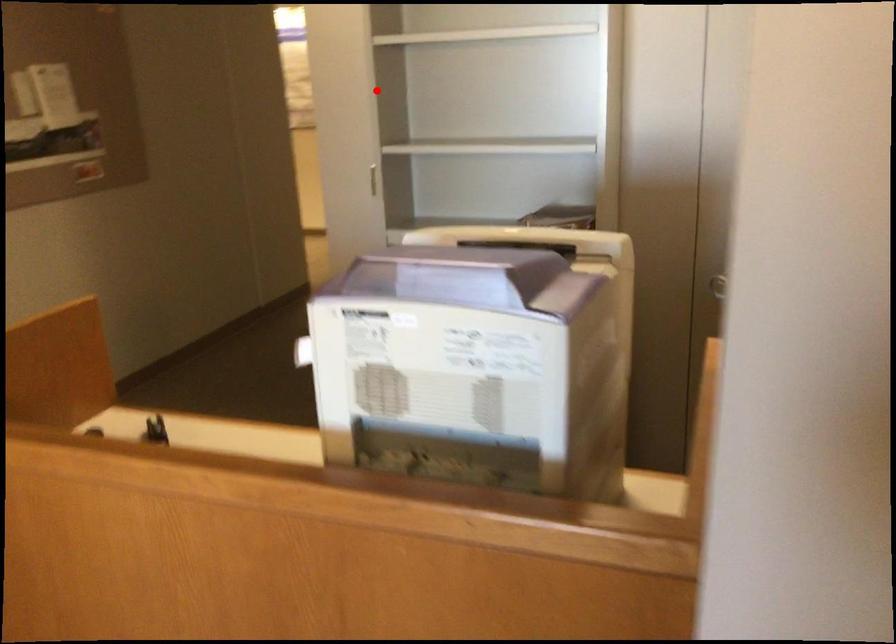
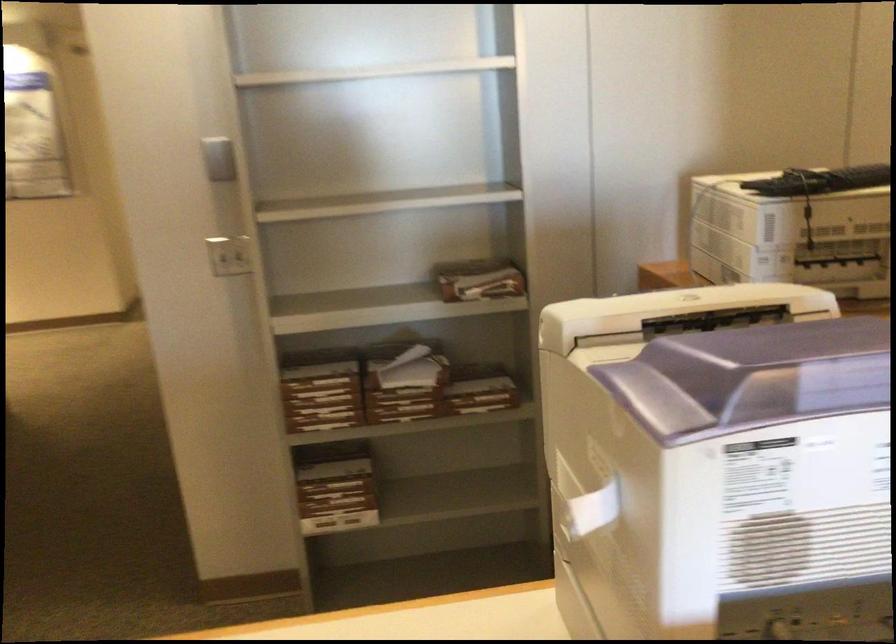
Question: I am providing you with two images of the same scene from different viewpoints. Given a red point in image1, look at the same physical point in image2. Is it:

Choices:
 (A) Closer to the viewpoint
 (B) Farther from the viewpoint

Answer: (A)